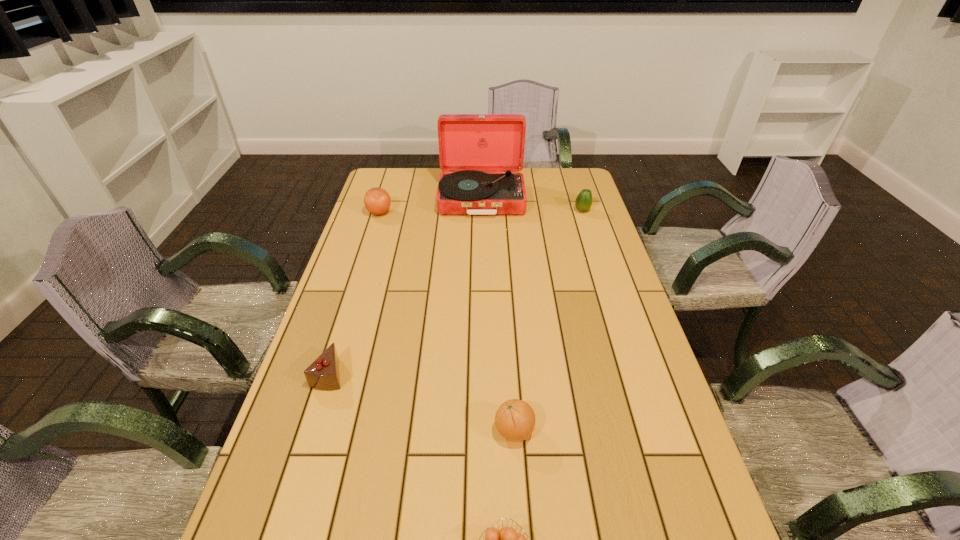
The width and height of the screenshot is (960, 540). Find the location of `vacant region that satisfies the following two spatial constraints: 1. on the front-facing side of the rightmost object; 2. on the left side of the tallest object`. vacant region that satisfies the following two spatial constraints: 1. on the front-facing side of the rightmost object; 2. on the left side of the tallest object is located at coordinates (482, 211).

You are a GUI agent. You are given a task and a screenshot of the screen. Output one action in this format:
    pyautogui.click(x=<x>, y=<y>)
    Task: Click on the blank area in the image that satisfies the following two spatial constraints: 1. on the front-facing side of the phonograph_record; 2. on the right side of the rightmost object
    
    Given the screenshot: What is the action you would take?
    pyautogui.click(x=482, y=211)

Identify the location of vacant space that satisfies the following two spatial constraints: 1. on the front-facing side of the second tallest orange fruit; 2. on the left side of the phonograph_record. Image resolution: width=960 pixels, height=540 pixels. (483, 430).